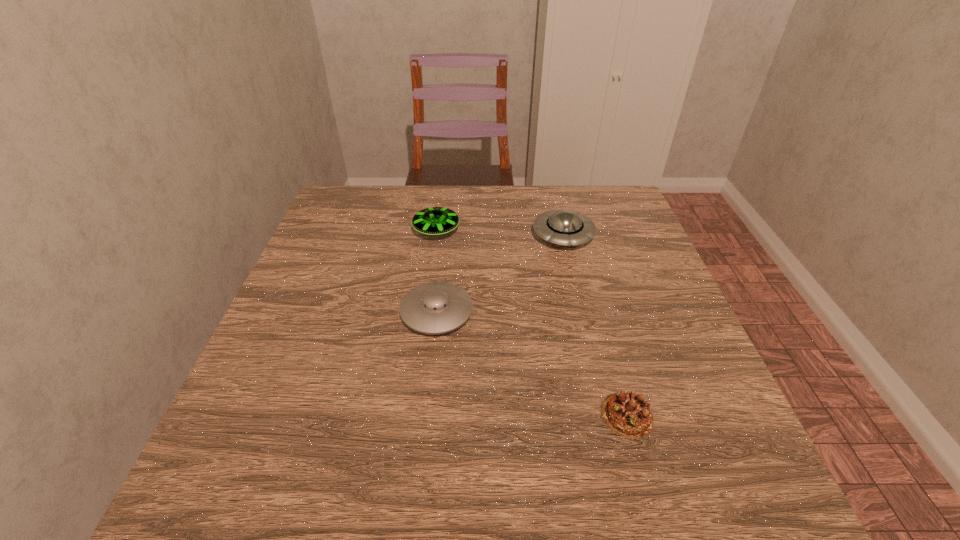
Where is `the rightmost saucer`? the rightmost saucer is located at coordinates 565,227.

Identify the location of the shortest saucer. The height and width of the screenshot is (540, 960). (438, 307).

The image size is (960, 540). I want to click on the nearest saucer, so click(x=438, y=307).

I want to click on the shortest object, so click(627, 414).

Image resolution: width=960 pixels, height=540 pixels. I want to click on chocolate cake, so click(x=627, y=414).

You are a GUI agent. You are given a task and a screenshot of the screen. Output one action in this format:
    pyautogui.click(x=<x>, y=<y>)
    Task: Click on the free region located 0.060m on the right of the rightmost saucer
    This screenshot has height=540, width=960.
    Given the screenshot: What is the action you would take?
    pyautogui.click(x=617, y=235)

The width and height of the screenshot is (960, 540). I want to click on free space located on the back of the third tallest object, so click(x=442, y=265).

Identify the location of vacant area situated 0.210m on the left of the shortest object. (477, 415).

Find the location of a particular element. This screenshot has width=960, height=540. saucer that is at the right edge is located at coordinates (565, 227).

You are a GUI agent. You are given a task and a screenshot of the screen. Output one action in this format:
    pyautogui.click(x=<x>, y=<y>)
    Task: Click on the chocolate cake at the right edge
    
    Given the screenshot: What is the action you would take?
    pyautogui.click(x=627, y=414)